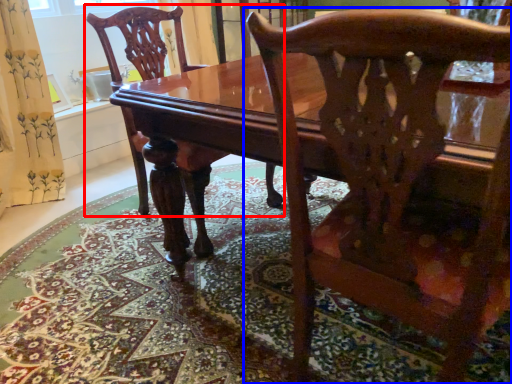
Question: Which of the following is the closest to the observer, chair (highlighted by a red box) or chair (highlighted by a blue box)?

Choices:
 (A) chair
 (B) chair

Answer: (B)